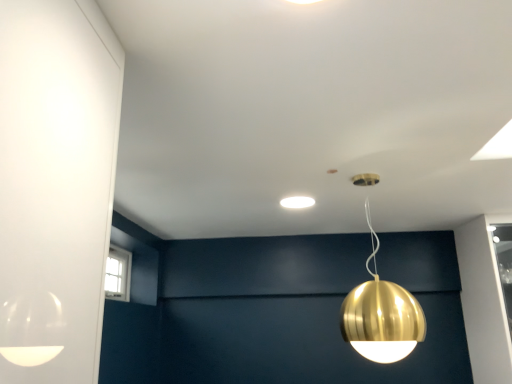
Question: Is white matte light fixture at center, which is the 2th lamp from front to back, further to camera compared to gold metallic sphere at upper center, which is the 1th lamp in bottom-to-top order?

Choices:
 (A) yes
 (B) no

Answer: (A)

Question: Can you confirm if white matte light fixture at center, which is the 2th lamp from front to back, is positioned to the right of gold metallic sphere at upper center, the second lamp from the top?

Choices:
 (A) yes
 (B) no

Answer: (B)

Question: Considering the relative sizes of white matte light fixture at center, which appears as the second lamp when viewed from the right, and gold metallic sphere at upper center, positioned as the 1th lamp in right-to-left order, in the image provided, is white matte light fixture at center, which appears as the second lamp when viewed from the right, wider than gold metallic sphere at upper center, positioned as the 1th lamp in right-to-left order,?

Choices:
 (A) yes
 (B) no

Answer: (B)

Question: Is white matte light fixture at center, which is counted as the 2th lamp, starting from the bottom, smaller than gold metallic sphere at upper center, positioned as the 1th lamp in right-to-left order?

Choices:
 (A) yes
 (B) no

Answer: (A)

Question: From the image's perspective, is white matte light fixture at center, which is the 2th lamp from front to back, on gold metallic sphere at upper center, which is the 1th lamp in bottom-to-top order?

Choices:
 (A) yes
 (B) no

Answer: (A)

Question: From a real-world perspective, is white matte light fixture at center, which is counted as the 2th lamp, starting from the bottom, physically above gold metallic sphere at upper center, the second lamp from the top?

Choices:
 (A) yes
 (B) no

Answer: (A)

Question: Is gold metallic sphere at upper center, which is the 1th lamp in bottom-to-top order, positioned far away from white matte light fixture at center, the first lamp when ordered from left to right?

Choices:
 (A) yes
 (B) no

Answer: (B)

Question: From a real-world perspective, is gold metallic sphere at upper center, the second lamp from the top, physically below white matte light fixture at center, which appears as the second lamp when viewed from the right?

Choices:
 (A) no
 (B) yes

Answer: (B)

Question: Is the position of gold metallic sphere at upper center, positioned as the 1th lamp in right-to-left order, more distant than that of white matte light fixture at center, which is the 2th lamp from front to back?

Choices:
 (A) yes
 (B) no

Answer: (B)

Question: From the image's perspective, does gold metallic sphere at upper center, arranged as the 2th lamp when viewed from the left, appear lower than white matte light fixture at center, which is the 2th lamp from front to back?

Choices:
 (A) no
 (B) yes

Answer: (B)

Question: Does gold metallic sphere at upper center, arranged as the 2th lamp when viewed from the left, have a greater height compared to white matte light fixture at center, which is counted as the 2th lamp, starting from the bottom?

Choices:
 (A) yes
 (B) no

Answer: (A)

Question: Would you say gold metallic sphere at upper center, which is the 2th lamp in back-to-front order, contains white matte light fixture at center, which is counted as the 2th lamp, starting from the bottom?

Choices:
 (A) no
 (B) yes

Answer: (A)

Question: From the image's perspective, relative to white matte light fixture at center, which is counted as the 1th lamp, starting from the back, is gold metallic sphere at upper center, positioned as the 1th lamp in front-to-back order, above or below?

Choices:
 (A) above
 (B) below

Answer: (B)